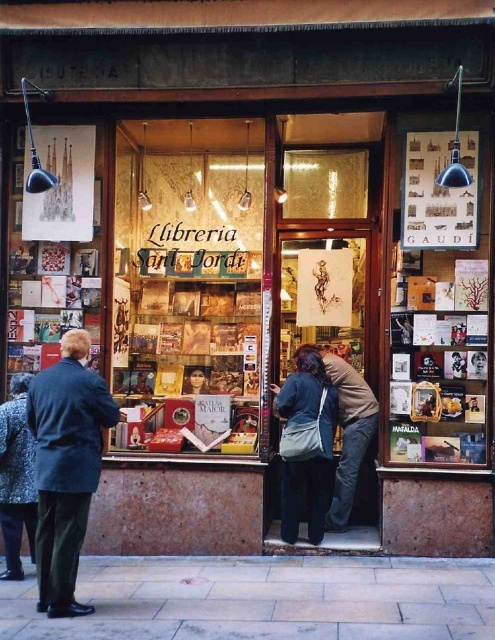
You are a customer entering the bookstore and see the speckled wool coat at lower left and the dark blue fabric bag at center. Which object is closer to the entrance?

The dark blue fabric bag at center is closer to the entrance because the speckled wool coat at lower left is behind it.

You are a customer entering the bookstore and notice two coats hanging on the rack near the entrance. The dark blue coat at left and the speckled wool coat at lower left. Which coat is taller?

The dark blue coat at left is much taller than the speckled wool coat at lower left.